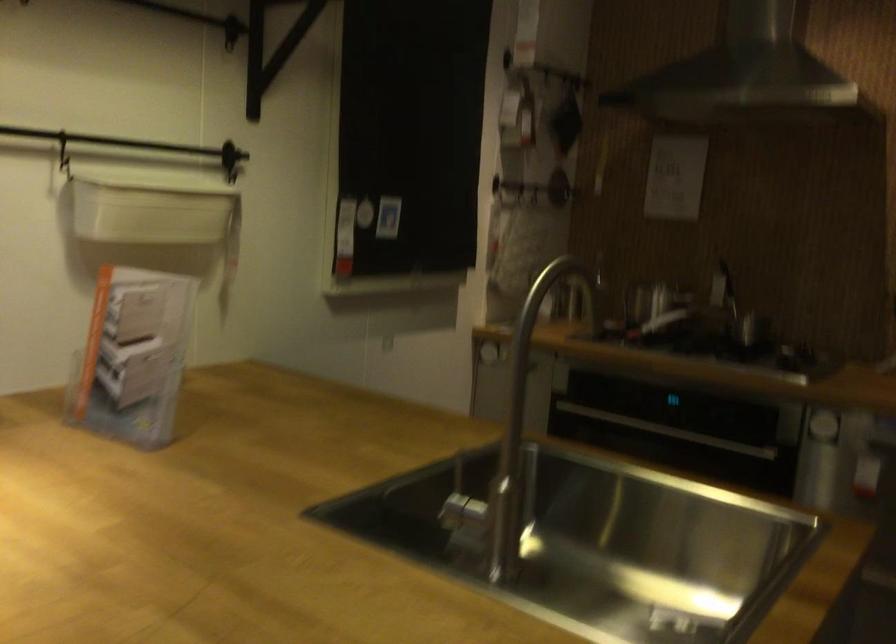
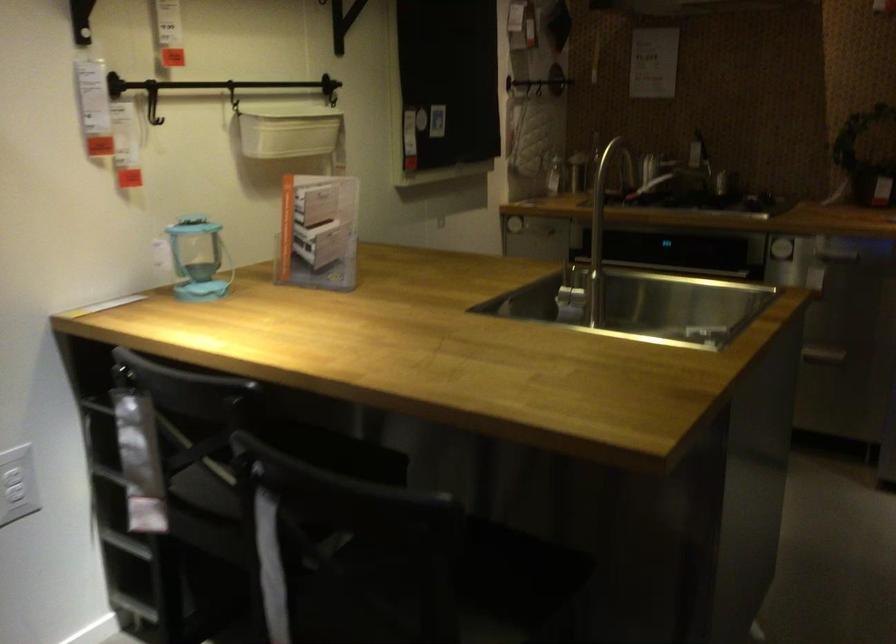
Locate, in the second image, the point that corresponds to point (142, 205) in the first image.

(287, 129)